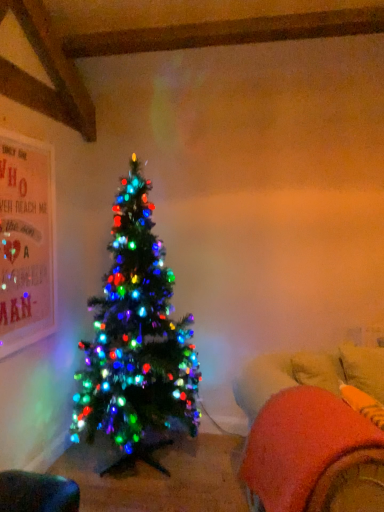
Question: Is fluffy orange bean bag at lower right, acting as the 2th bean bag chair starting from the left, situated inside velvet orange bean bag chair at lower left, the first bean bag chair positioned from the left, or outside?

Choices:
 (A) outside
 (B) inside

Answer: (A)

Question: Based on their positions, is fluffy orange bean bag at lower right, acting as the 2th bean bag chair starting from the left, located to the left or right of velvet orange bean bag chair at lower left, the 2th bean bag chair in the top-to-bottom sequence?

Choices:
 (A) left
 (B) right

Answer: (B)

Question: From the image's perspective, is fluffy orange bean bag at lower right, arranged as the 1th bean bag chair when viewed from the top, above or below velvet orange bean bag chair at lower left, the 2th bean bag chair in the top-to-bottom sequence?

Choices:
 (A) below
 (B) above

Answer: (B)

Question: Considering the positions of point (8, 483) and point (301, 364), is point (8, 483) closer or farther from the camera than point (301, 364)?

Choices:
 (A) farther
 (B) closer

Answer: (B)

Question: Is velvet orange bean bag chair at lower left, marked as the first bean bag chair in a bottom-to-top arrangement, taller or shorter than fluffy orange bean bag at lower right, placed as the 1th bean bag chair when sorted from right to left?

Choices:
 (A) tall
 (B) short

Answer: (B)

Question: From a real-world perspective, is velvet orange bean bag chair at lower left, the first bean bag chair positioned from the left, above or below fluffy orange bean bag at lower right, arranged as the 1th bean bag chair when viewed from the top?

Choices:
 (A) below
 (B) above

Answer: (A)

Question: Is velvet orange bean bag chair at lower left, the first bean bag chair positioned from the left, inside the boundaries of fluffy orange bean bag at lower right, placed as the 1th bean bag chair when sorted from right to left, or outside?

Choices:
 (A) outside
 (B) inside

Answer: (A)